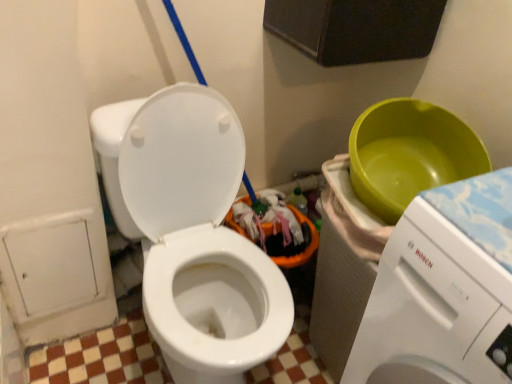
Question: Would you say white glossy washing machine at right is to the left or to the right of white glossy toilet at center in the picture?

Choices:
 (A) right
 (B) left

Answer: (A)

Question: From the image's perspective, is white glossy washing machine at right located above or below white glossy toilet at center?

Choices:
 (A) above
 (B) below

Answer: (B)

Question: Relative to white glossy toilet at center, is white glossy washing machine at right in front or behind?

Choices:
 (A) behind
 (B) front

Answer: (B)

Question: Considering the positions of point (218, 324) and point (494, 304), is point (218, 324) closer or farther from the camera than point (494, 304)?

Choices:
 (A) closer
 (B) farther

Answer: (B)

Question: In the image, is white glossy toilet at center positioned in front of or behind white glossy washing machine at right?

Choices:
 (A) behind
 (B) front

Answer: (A)

Question: From a real-world perspective, is white glossy toilet at center physically located above or below white glossy washing machine at right?

Choices:
 (A) below
 (B) above

Answer: (B)

Question: Is white glossy toilet at center taller or shorter than white glossy washing machine at right?

Choices:
 (A) tall
 (B) short

Answer: (B)